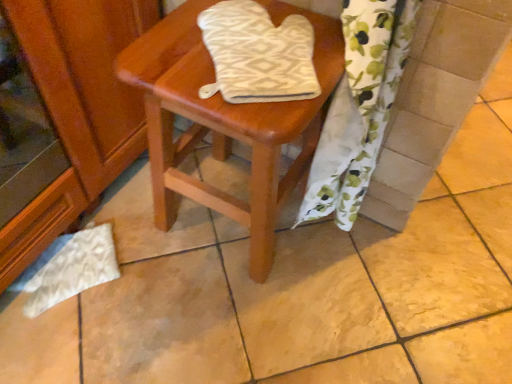
Question: Should I look upward or downward to see white textured oven mitt at center?

Choices:
 (A) down
 (B) up

Answer: (B)

Question: Does white floral fabric at lower right have a lesser height compared to white textured oven mitt at center?

Choices:
 (A) no
 (B) yes

Answer: (A)

Question: Would you say white floral fabric at lower right is a long distance from white textured oven mitt at center?

Choices:
 (A) no
 (B) yes

Answer: (A)

Question: From a real-world perspective, is white floral fabric at lower right over white textured oven mitt at center?

Choices:
 (A) no
 (B) yes

Answer: (A)

Question: Does white floral fabric at lower right turn towards white textured oven mitt at center?

Choices:
 (A) yes
 (B) no

Answer: (B)

Question: Considering the relative sizes of white floral fabric at lower right and white textured oven mitt at center in the image provided, is white floral fabric at lower right bigger than white textured oven mitt at center?

Choices:
 (A) no
 (B) yes

Answer: (B)

Question: Are white floral fabric at lower right and white textured oven mitt at center beside each other?

Choices:
 (A) yes
 (B) no

Answer: (B)

Question: Is white textured oven mitt at center bigger than wooden stool at center?

Choices:
 (A) yes
 (B) no

Answer: (B)

Question: Is white textured oven mitt at center facing away from wooden stool at center?

Choices:
 (A) no
 (B) yes

Answer: (A)

Question: From a real-world perspective, is white textured oven mitt at center physically above wooden stool at center?

Choices:
 (A) no
 (B) yes

Answer: (B)

Question: Considering the relative sizes of white textured oven mitt at center and wooden stool at center in the image provided, is white textured oven mitt at center wider than wooden stool at center?

Choices:
 (A) yes
 (B) no

Answer: (B)

Question: Considering the relative sizes of white textured oven mitt at center and wooden stool at center in the image provided, is white textured oven mitt at center thinner than wooden stool at center?

Choices:
 (A) yes
 (B) no

Answer: (A)

Question: Is white textured oven mitt at center not close to wooden stool at center?

Choices:
 (A) yes
 (B) no

Answer: (B)

Question: Is white floral fabric at lower right taller than wooden stool at center?

Choices:
 (A) yes
 (B) no

Answer: (A)